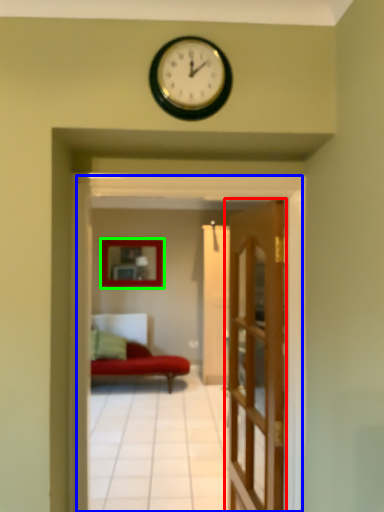
Question: Estimate the real-world distances between objects in this image. Which object is farther from door (highlighted by a red box), residence (highlighted by a blue box) or picture frame (highlighted by a green box)?

Choices:
 (A) residence
 (B) picture frame

Answer: (B)